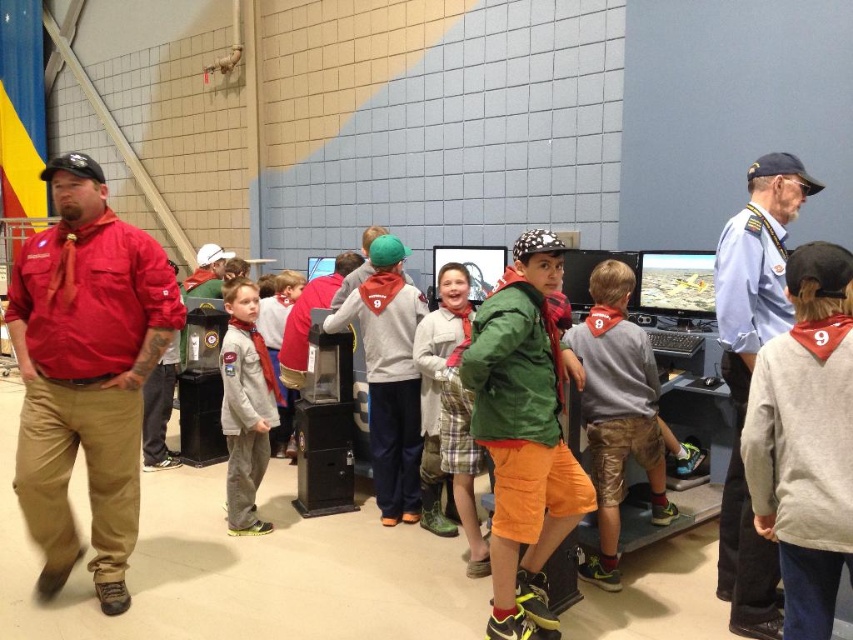
Measure the distance between gray fleece sweatshirt at center and green fabric shirt at center.

A: gray fleece sweatshirt at center is 26.78 inches from green fabric shirt at center.

Between point (224, 381) and point (347, 264), which one is positioned in front?

Point (224, 381)

Locate an element on the screen. This screenshot has height=640, width=853. gray fleece sweatshirt at center is located at coordinates (245, 406).

Does point (399, 461) come behind point (293, 276)?

No, (399, 461) is in front of (293, 276).

Does point (402, 356) lie in front of point (285, 429)?

Yes, it is.

Is point (399, 390) behind point (276, 349)?

No, it is not.

Where is `gray fleece hoodie at center`? gray fleece hoodie at center is located at coordinates (387, 376).

Which is below, light blue uniform at center or green fabric shirt at center?

green fabric shirt at center is below.

Which is behind, point (766, 557) or point (282, 358)?

Positioned behind is point (282, 358).

Locate an element on the screen. light blue uniform at center is located at coordinates (751, 372).